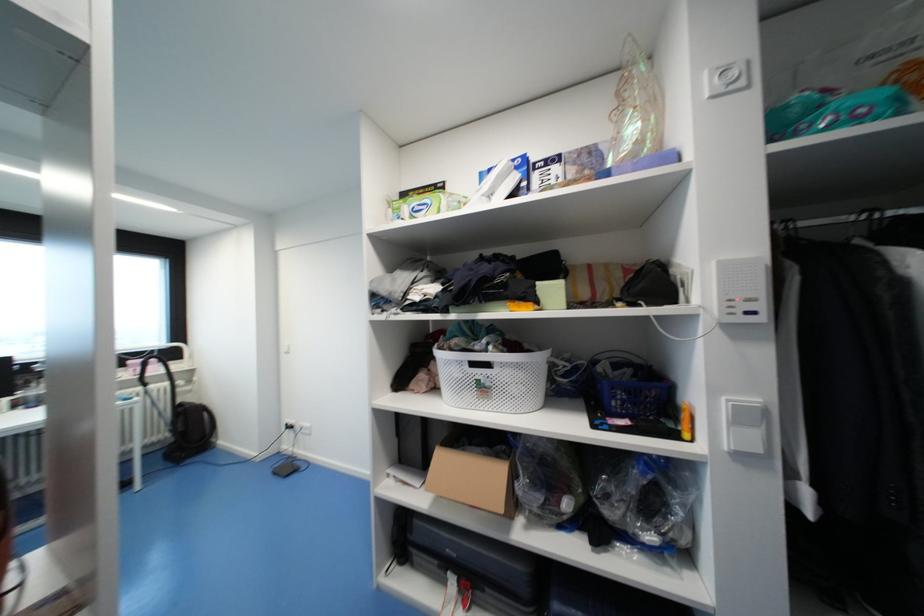
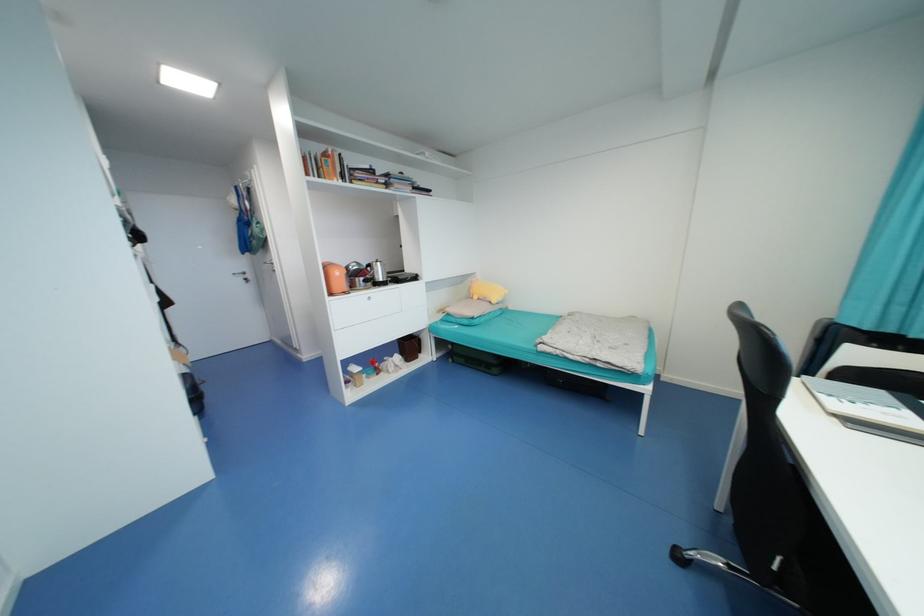
Question: I am providing you with two images of the same scene from different viewpoints. Please identify which objects are invisible in image2.

Choices:
 (A) white basket handle
 (B) orange kettle
 (C) blue bag
 (D) small clear cup

Answer: (A)